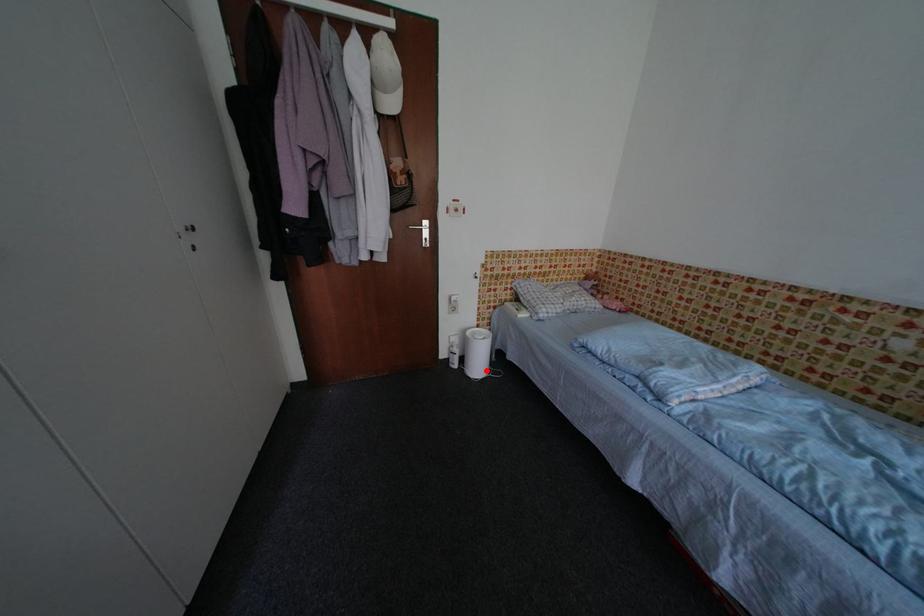
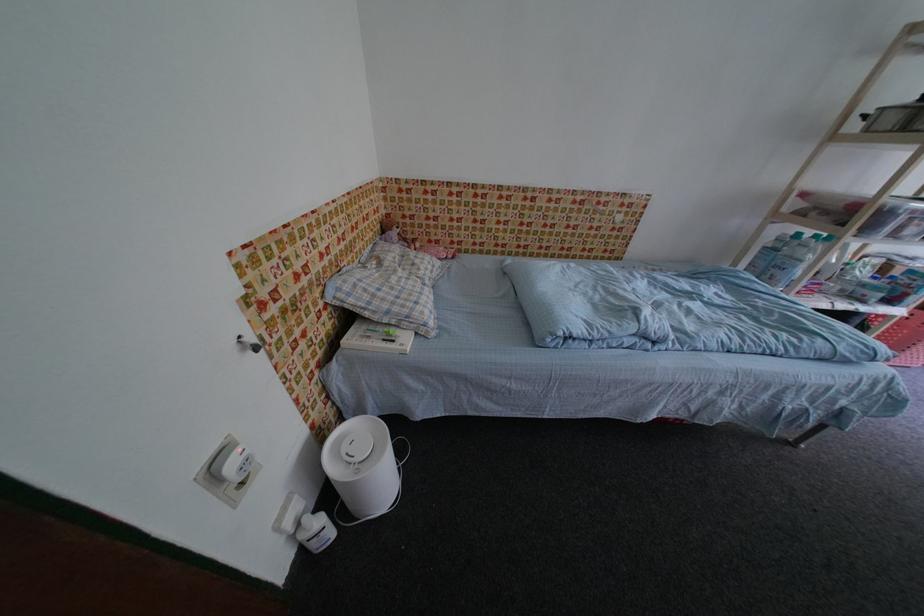
Question: I am providing you with two images of the same scene from different viewpoints. Image1 has a red point marked. In image2, the corresponding 3D location appears at what relative position? Reply with the corresponding letter.

Choices:
 (A) Closer
 (B) Farther

Answer: (B)